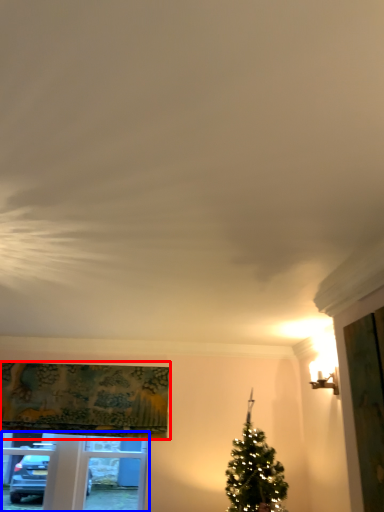
Question: Which of the following is the farthest to the observer, curtain (highlighted by a red box) or window frame (highlighted by a blue box)?

Choices:
 (A) curtain
 (B) window frame

Answer: (B)